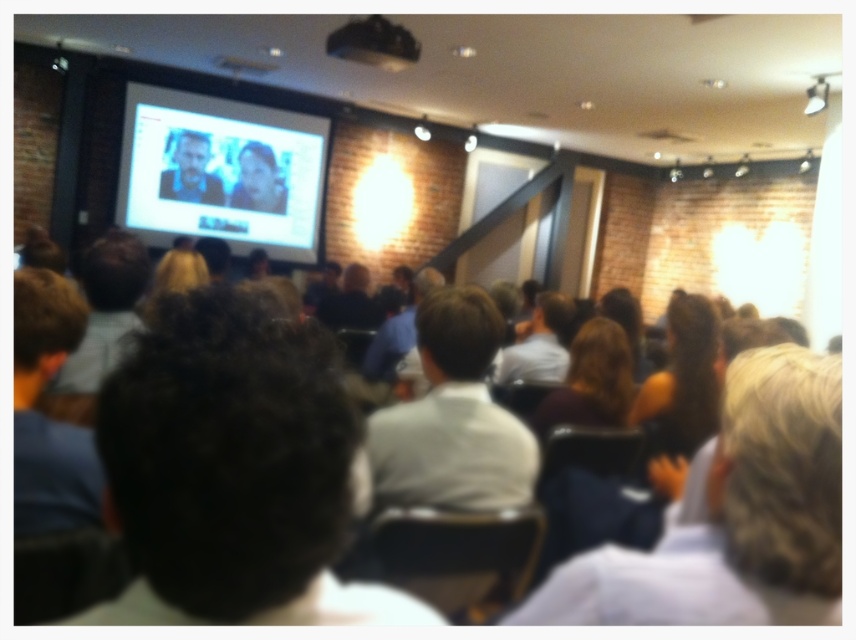
You are an event organizer and need to ensure that all attendees are visible on the camera. You notice two people in the center of the image with dark brown hair at center and white shirt at center. Which one is blocking the other from the camera view?

The dark brown hair at center is positioned under white shirt at center, so the dark brown hair at center is blocking the white shirt at center from the camera view.

You are an event planner organizing a photo shoot for a corporate event. You need to capture a candid shot of the dark brown hair at center and the white shirt at center. Since the camera has a limited depth of field, which subject should you focus on to ensure the other remains in the background?

Since the dark brown hair at center is taller than the white shirt at center, focusing on the dark brown hair at center will keep the white shirt at center in the background with a blurred effect.

You are an attendee sitting at the back of the room facing the large screen. You notice two points marked on the screen at coordinates point (817, 396) and point (562, 292). Which point appears closer to you?

Point (817, 396) is closer to the viewer than point (562, 292), so the point at (817, 396) appears closer to you.